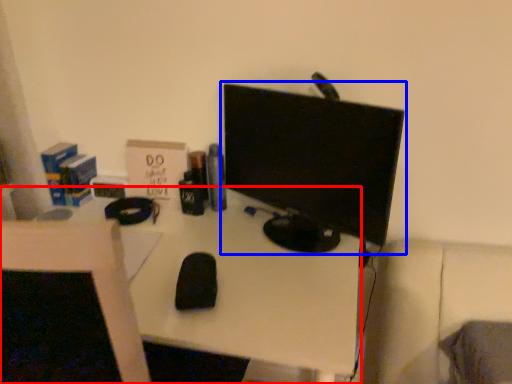
Question: Which object is further to the camera taking this photo, desk (highlighted by a red box) or computer monitor (highlighted by a blue box)?

Choices:
 (A) desk
 (B) computer monitor

Answer: (B)